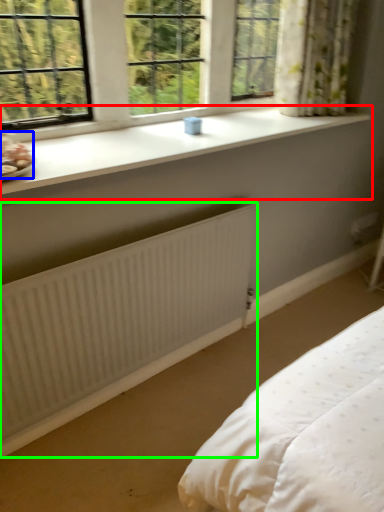
Question: Estimate the real-world distances between objects in this image. Which object is farther from window sill (highlighted by a red box), food (highlighted by a blue box) or radiator (highlighted by a green box)?

Choices:
 (A) food
 (B) radiator

Answer: (B)